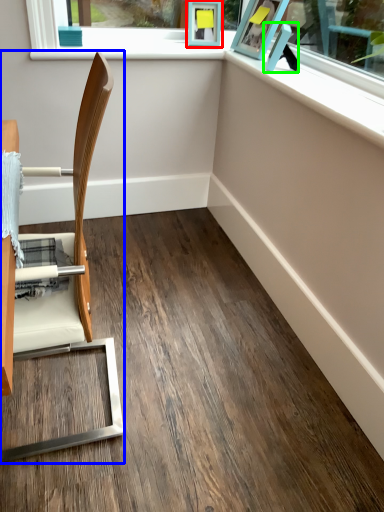
Question: Which object is the farthest from picture frame (highlighted by a red box)? Choose among these: chair (highlighted by a blue box) or picture frame (highlighted by a green box).

Choices:
 (A) chair
 (B) picture frame

Answer: (A)